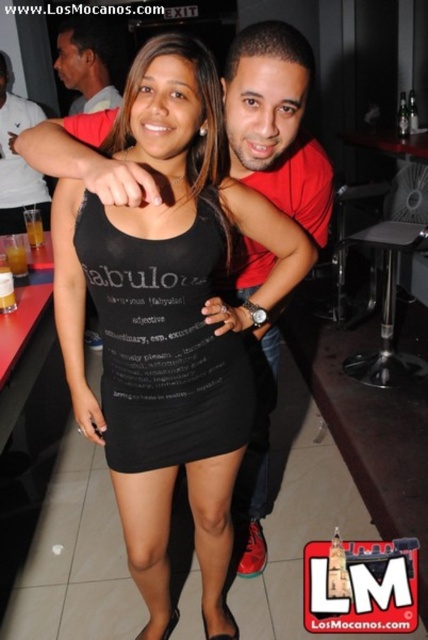
You are a photographer at the event and want to ensure both the black fabric dress at center and the black matte tank top at center are clearly visible in the photo. Given their sizes, which one might require more careful framing to avoid being overshadowed?

The black matte tank top at center is smaller in size than the black fabric dress at center, so it might require more careful framing to avoid being overshadowed.

You are a photographer at the event and want to ensure that both the black fabric dress at center and the black matte tank top at center are clearly visible in the photo. Given their current distance apart, is there a risk that they might appear too close together in the frame?

The black fabric dress at center and the black matte tank top at center are 6.82 centimeters apart, so they are sufficiently spaced to be distinguishable in the photo without appearing too close together.